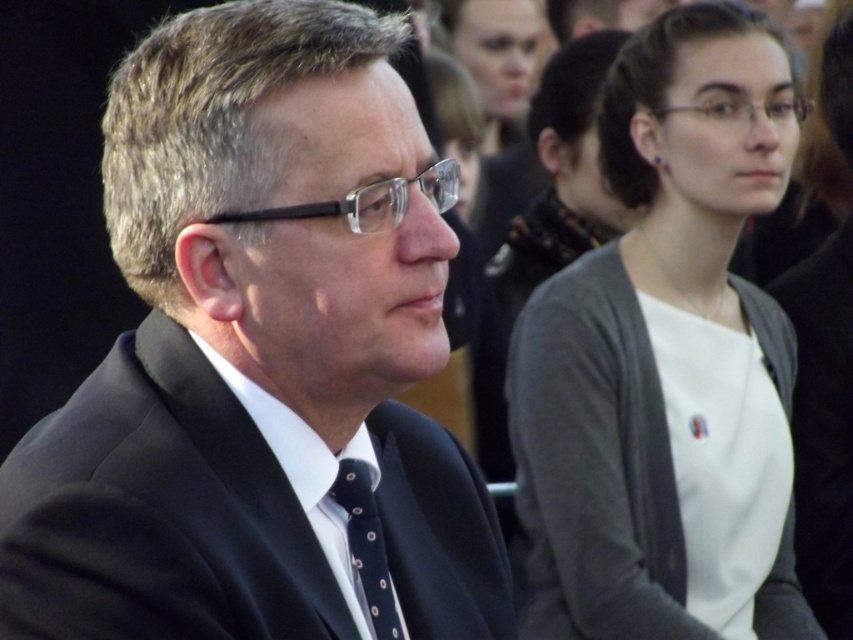
Who is positioned more to the left, black suit at left or white matte shirt at upper right?

black suit at left

Is black suit at left bigger than white matte shirt at upper right?

Incorrect, black suit at left is not larger than white matte shirt at upper right.

Does point (238, 100) lie in front of point (524, 328)?

Yes, point (238, 100) is closer to viewer.

Where is `black suit at left`? black suit at left is located at coordinates click(258, 355).

Who is taller, white matte shirt at upper right or dark blue textured tie at center?

white matte shirt at upper right is taller.

Find the location of `white matte shirt at upper right`. white matte shirt at upper right is located at coordinates (666, 362).

At what (x,y) coordinates should I click in order to perform the action: click on white matte shirt at upper right. Please return your answer as a coordinate pair (x, y). This screenshot has height=640, width=853. Looking at the image, I should click on (666, 362).

Is black suit at left shorter than dark blue textured tie at center?

No.

Is black suit at left smaller than dark blue textured tie at center?

No.

What do you see at coordinates (258, 355) in the screenshot?
I see `black suit at left` at bounding box center [258, 355].

This screenshot has height=640, width=853. I want to click on black suit at left, so click(258, 355).